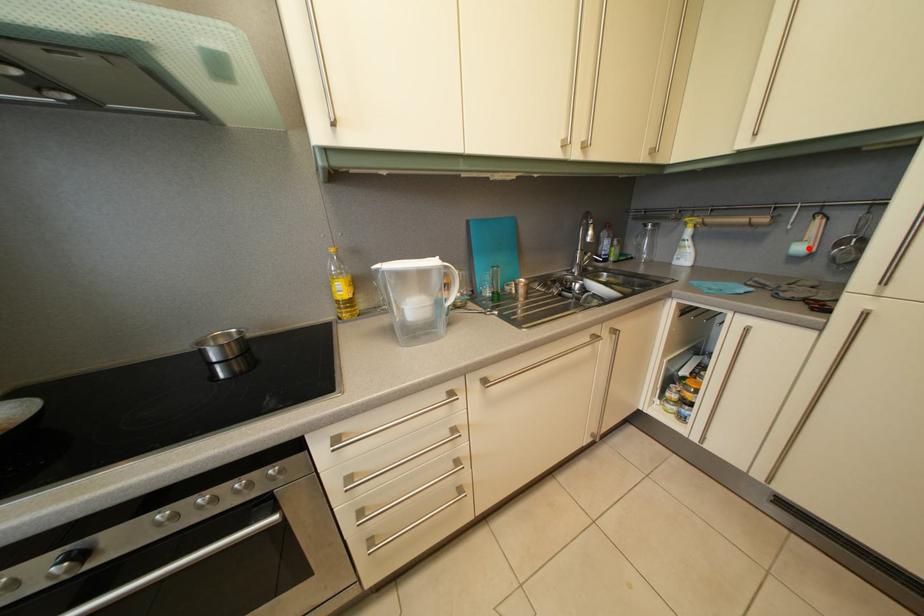
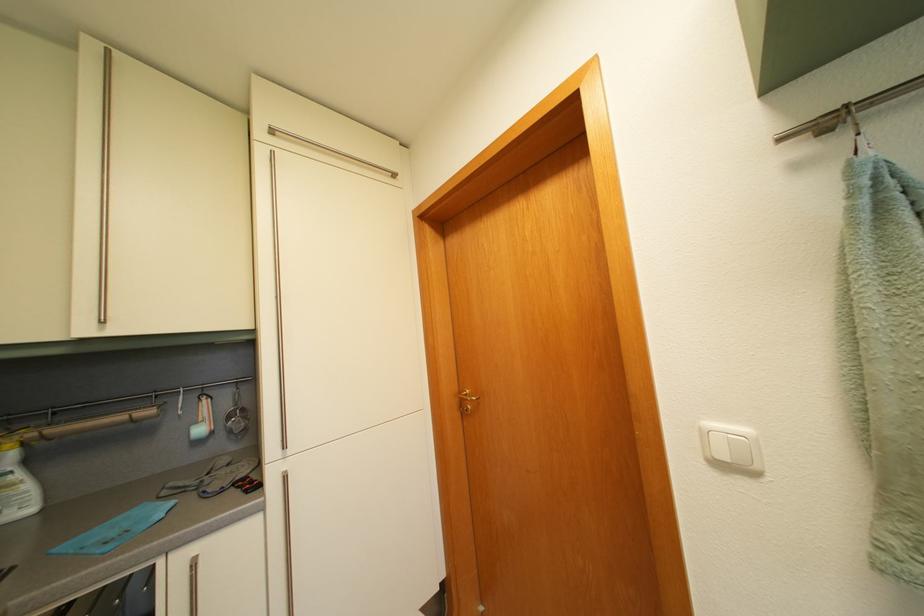
Locate, in the second image, the point that corresponds to the highlighted location in the first image.

(204, 430)